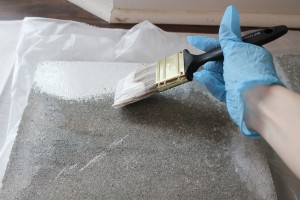
You are a GUI agent. You are given a task and a screenshot of the screen. Output one action in this format:
    pyautogui.click(x=<x>, y=<y>)
    Task: Click on the paint surface
    This screenshot has width=300, height=200.
    Given the screenshot: What is the action you would take?
    pyautogui.click(x=122, y=162)